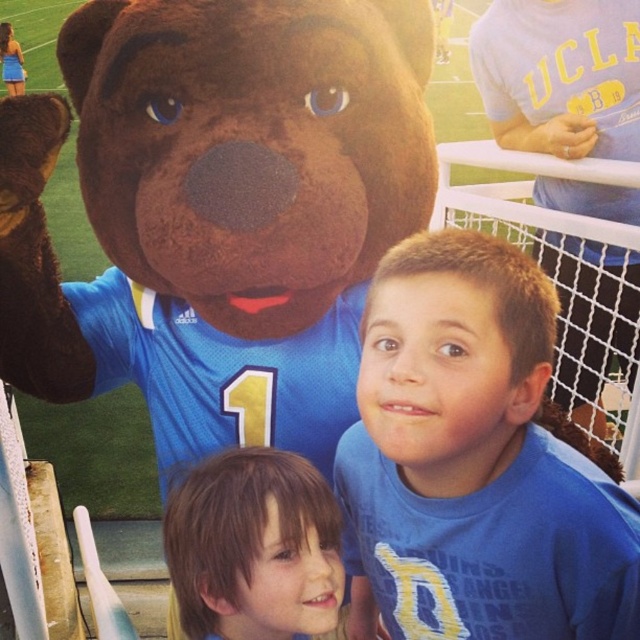
Where is the blue jersey at center located in the image?

The blue jersey at center is located at point 0.722 in the x coordinate and 0.742 in the y coordinate.

You are a photographer trying to capture a clear shot of both the blue jersey at center and the brown hair at center. Since you can only focus on one subject at a time, which one should you choose to ensure the other is still somewhat in focus?

The blue jersey at center is closer to the viewer than brown hair at center. To ensure the brown hair at center is somewhat in focus, you should focus on the blue jersey at center because it is closer, and the brown hair at center will be slightly out of focus but still recognizable.

You are a photographer at the soccer game. You need to position yourself so that the blue jersey at center is visible above the brown hair at center. Is this possible based on their current positions?

The blue jersey at center is currently below the brown hair at center, so positioning yourself to see the blue jersey at center above the brown hair at center would not be possible without moving the objects.